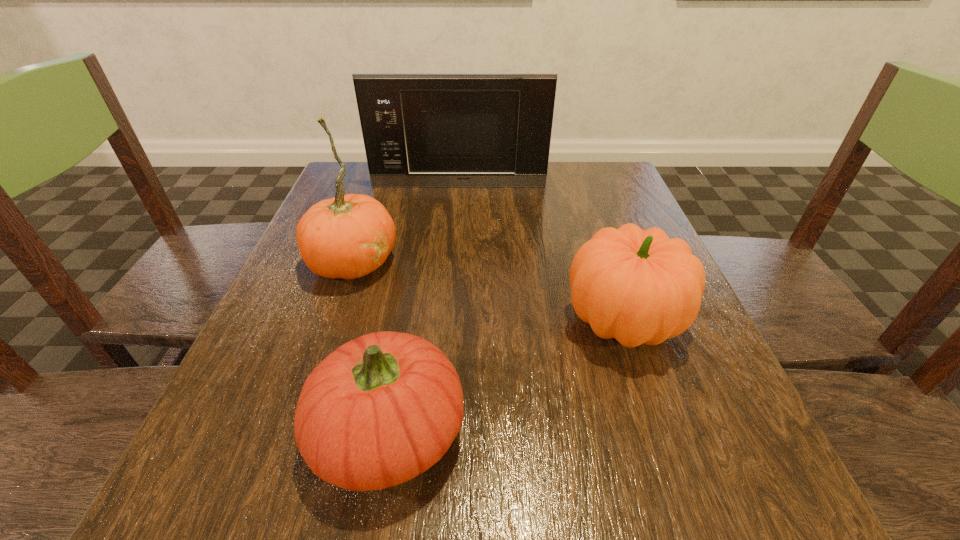
Where is `the closest pumpkin to the rightmost pumpkin`? This screenshot has width=960, height=540. the closest pumpkin to the rightmost pumpkin is located at coordinates (381, 409).

Where is `vacant region that satisfies the following two spatial constraints: 1. on the front panel of the rightmost pumpkin; 2. on the left side of the farthest object`? Image resolution: width=960 pixels, height=540 pixels. vacant region that satisfies the following two spatial constraints: 1. on the front panel of the rightmost pumpkin; 2. on the left side of the farthest object is located at coordinates (449, 321).

Locate an element on the screen. blank space that satisfies the following two spatial constraints: 1. on the front panel of the rightmost pumpkin; 2. on the left side of the microwave oven is located at coordinates (449, 321).

The image size is (960, 540). Find the location of `free space that satisfies the following two spatial constraints: 1. on the front side of the rightmost pumpkin; 2. on the left side of the tallest pumpkin`. free space that satisfies the following two spatial constraints: 1. on the front side of the rightmost pumpkin; 2. on the left side of the tallest pumpkin is located at coordinates (332, 321).

Locate an element on the screen. The height and width of the screenshot is (540, 960). free space that satisfies the following two spatial constraints: 1. on the back side of the rightmost pumpkin; 2. on the right side of the nearest pumpkin is located at coordinates (408, 321).